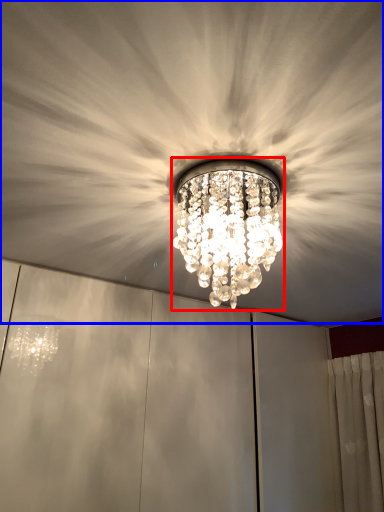
Question: Which object appears farthest to the camera in this image, lamp (highlighted by a red box) or fan (highlighted by a blue box)?

Choices:
 (A) lamp
 (B) fan

Answer: (A)